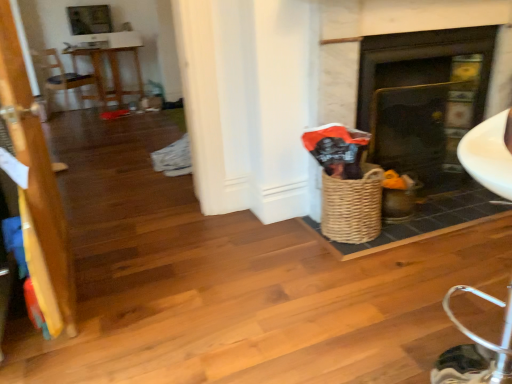
Find the location of a particular element. This screenshot has height=384, width=512. vacant location below wooden door at left (from a real-world perspective) is located at coordinates (79, 281).